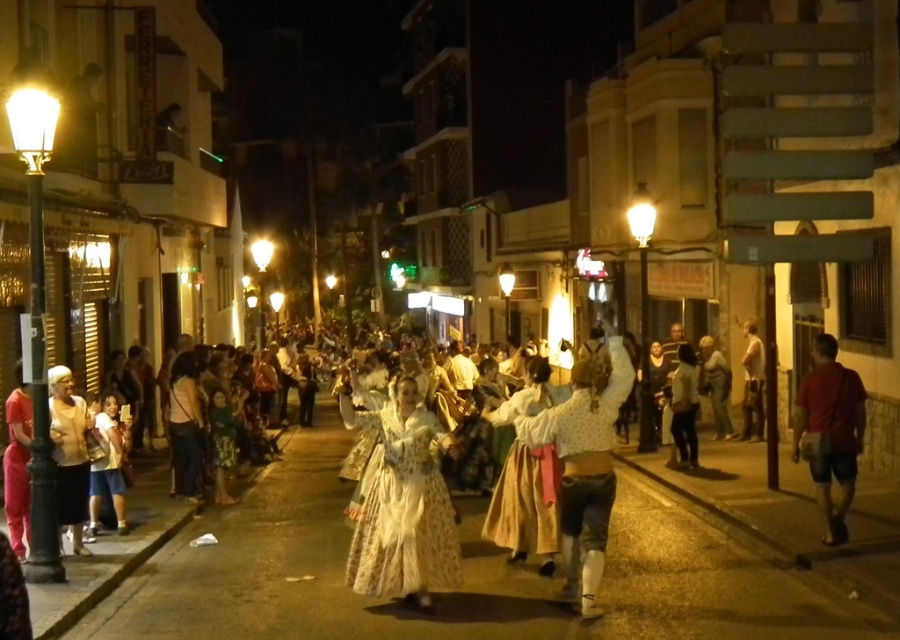
Which of these two, white lace dress at center or red cotton shirt at right, stands taller?

Standing taller between the two is red cotton shirt at right.

Is white lace dress at center bigger than red cotton shirt at right?

Indeed, white lace dress at center has a larger size compared to red cotton shirt at right.

Does point (356, 532) come closer to viewer compared to point (828, 512)?

Yes.

The width and height of the screenshot is (900, 640). In order to click on white lace dress at center in this screenshot , I will do `click(402, 508)`.

Which of these two, white lace dress at center or white lace blouse at center, stands shorter?

Standing shorter between the two is white lace blouse at center.

Which is more to the right, white lace dress at center or white lace blouse at center?

Positioned to the right is white lace blouse at center.

This screenshot has width=900, height=640. I want to click on white lace dress at center, so click(x=402, y=508).

Can you confirm if light beige fabric dress at lower left is taller than light brown leather jacket at right?

No, light beige fabric dress at lower left is not taller than light brown leather jacket at right.

Find the location of a particular element. light beige fabric dress at lower left is located at coordinates (69, 452).

Who is more distant from viewer, (x=63, y=493) or (x=753, y=406)?

The point (x=753, y=406) is more distant.

Locate an element on the screen. light beige fabric dress at lower left is located at coordinates (69, 452).